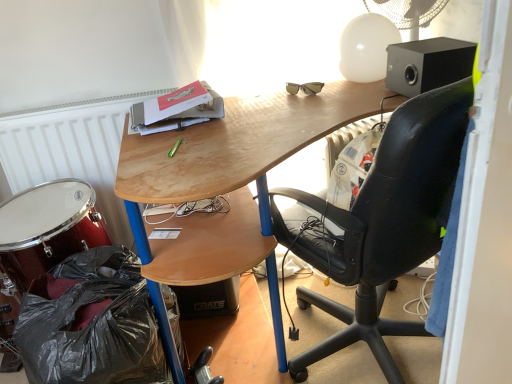
Question: Is shiny red drum at lower left to the right of white plastic mechanical fan at upper right from the viewer's perspective?

Choices:
 (A) yes
 (B) no

Answer: (B)

Question: From a real-world perspective, is shiny red drum at lower left under white plastic mechanical fan at upper right?

Choices:
 (A) no
 (B) yes

Answer: (B)

Question: From a real-world perspective, is shiny red drum at lower left on white plastic mechanical fan at upper right?

Choices:
 (A) no
 (B) yes

Answer: (A)

Question: Does shiny red drum at lower left appear on the left side of white plastic mechanical fan at upper right?

Choices:
 (A) yes
 (B) no

Answer: (A)

Question: Can you confirm if shiny red drum at lower left is thinner than white plastic mechanical fan at upper right?

Choices:
 (A) no
 (B) yes

Answer: (A)

Question: Is shiny red drum at lower left located outside white plastic mechanical fan at upper right?

Choices:
 (A) yes
 (B) no

Answer: (A)

Question: Does shiny red drum at lower left have a greater width compared to black leather chair at upper right?

Choices:
 (A) no
 (B) yes

Answer: (A)

Question: Is shiny red drum at lower left completely or partially outside of black leather chair at upper right?

Choices:
 (A) yes
 (B) no

Answer: (A)

Question: Can black leather chair at upper right be found inside shiny red drum at lower left?

Choices:
 (A) no
 (B) yes

Answer: (A)

Question: From a real-world perspective, is shiny red drum at lower left physically below black leather chair at upper right?

Choices:
 (A) yes
 (B) no

Answer: (A)

Question: Does shiny red drum at lower left come in front of black leather chair at upper right?

Choices:
 (A) no
 (B) yes

Answer: (A)

Question: From the image's perspective, would you say shiny red drum at lower left is shown under black leather chair at upper right?

Choices:
 (A) yes
 (B) no

Answer: (A)

Question: Can you confirm if black plastic bag at lower left is wider than black leather chair at upper right?

Choices:
 (A) yes
 (B) no

Answer: (B)